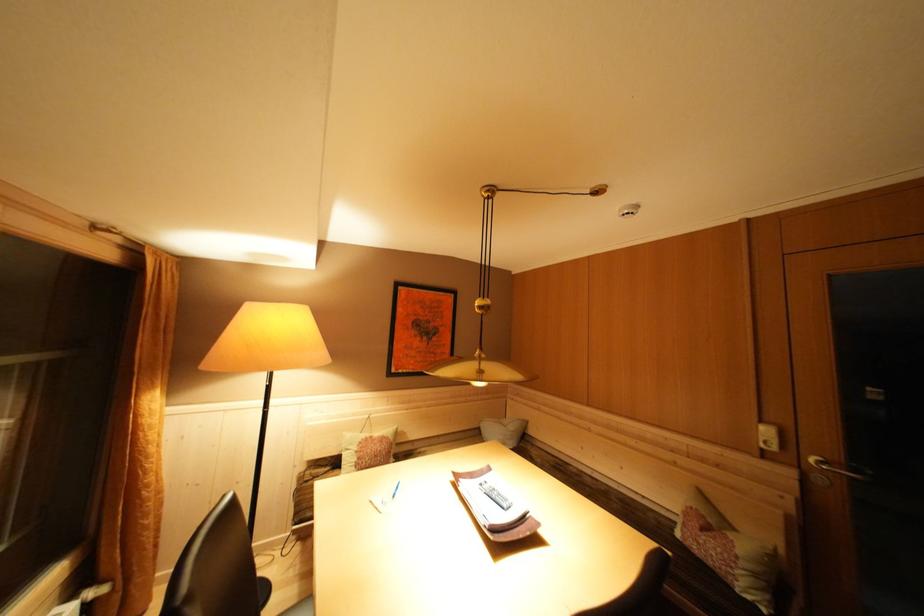
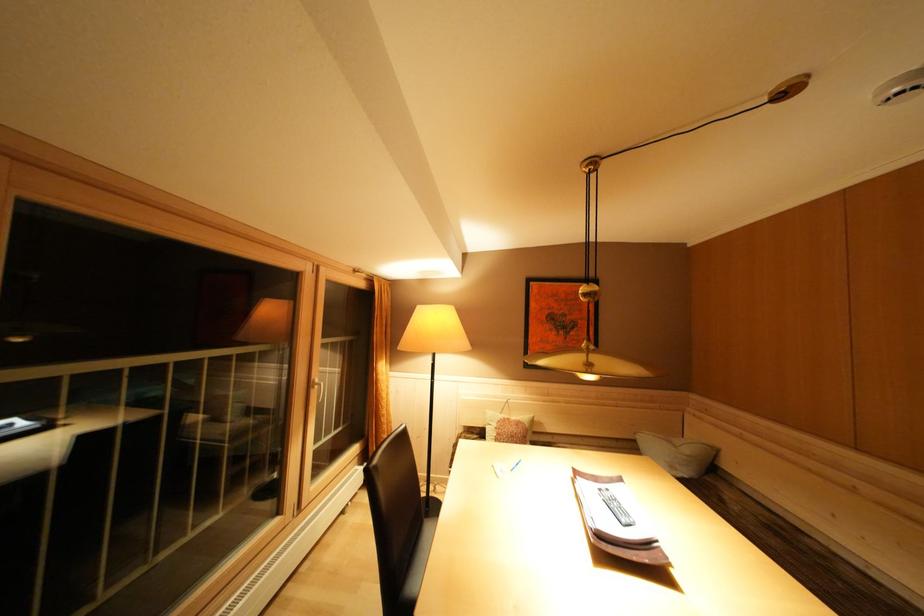
Find the pixel in the second image that matches the point at 378,442 in the first image.

(515, 424)